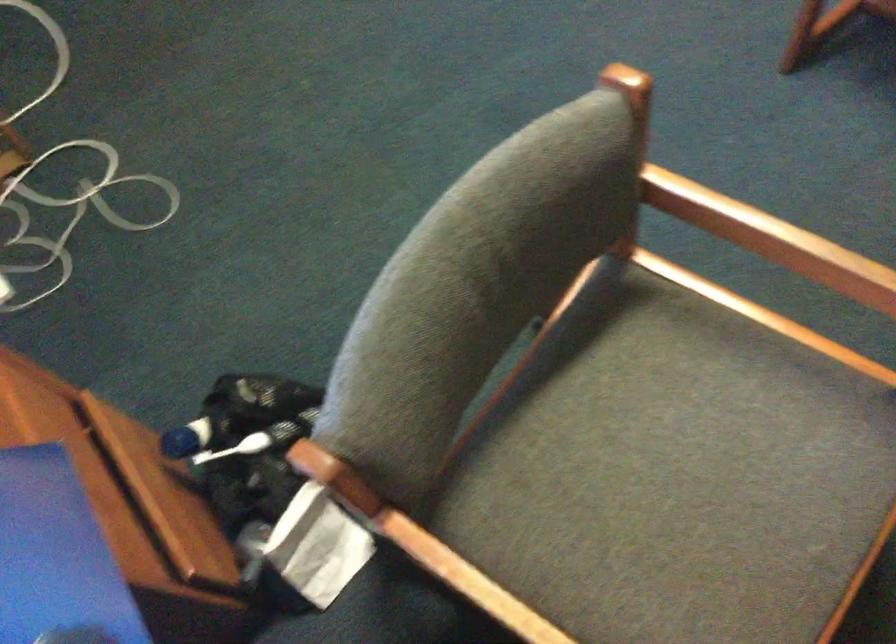
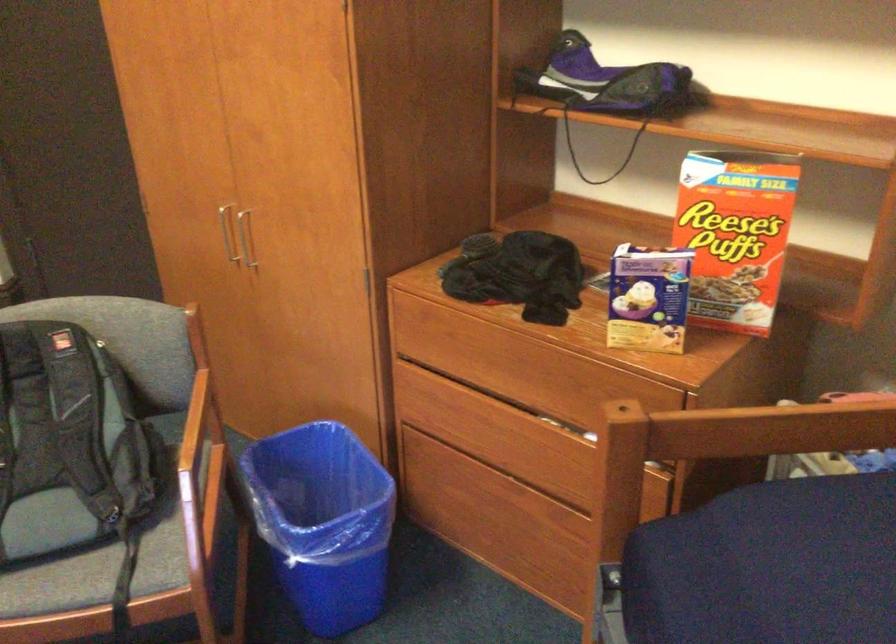
Based on the continuous images, in which direction is the camera rotating?

The camera rotated toward right-up.